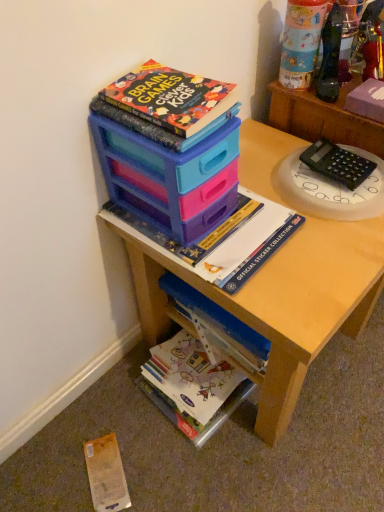
Locate an element on the screen. The width and height of the screenshot is (384, 512). free space in front of white glossy book at lower center, which is the 1th book from bottom to top is located at coordinates (201, 464).